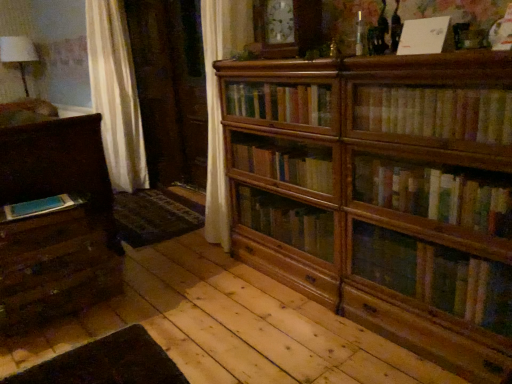
Locate an element on the screen. vacant space that's between wooden bookcase at center and wooden drawer at lower left, which is the first drawer in bottom-to-top order is located at coordinates (207, 314).